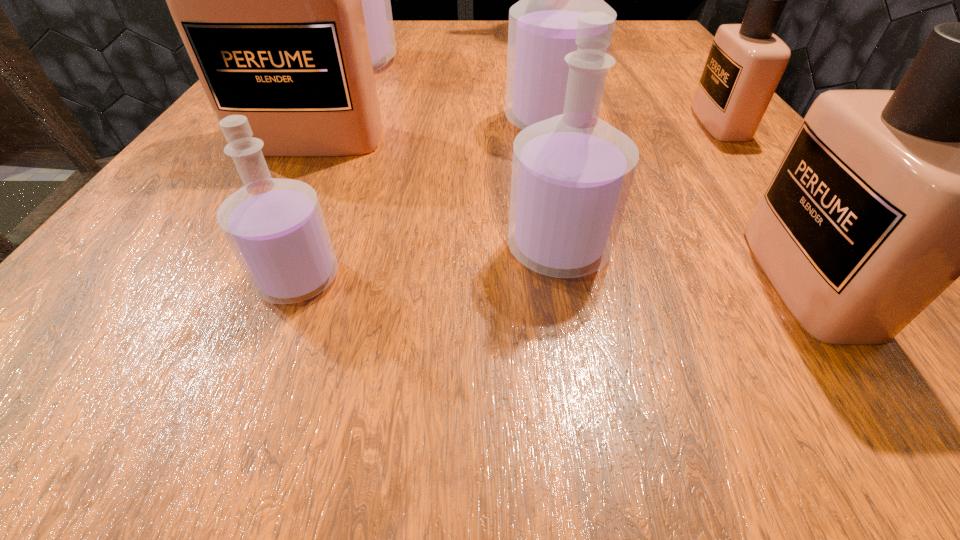
Find the location of a particular element. blank space that satisfies the following two spatial constraints: 1. on the front label of the biggest beige perfume; 2. on the right side of the smallest purple perfume is located at coordinates tap(235, 278).